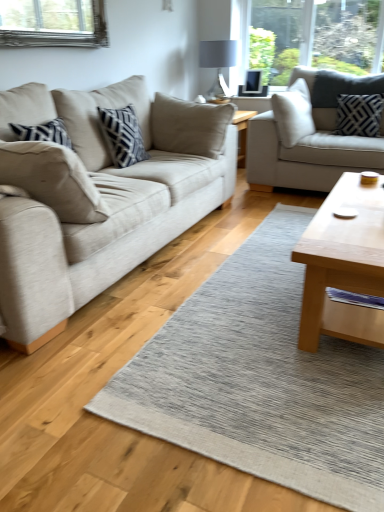
Question: Can you confirm if black textured pillow at upper right, arranged as the first pillow when viewed from the back, is smaller than textured gray rug at center?

Choices:
 (A) no
 (B) yes

Answer: (B)

Question: From the image's perspective, is black textured pillow at upper right, arranged as the second pillow when viewed from the left, located beneath textured gray rug at center?

Choices:
 (A) yes
 (B) no

Answer: (B)

Question: Does black textured pillow at upper right, arranged as the first pillow when viewed from the top, come in front of textured gray rug at center?

Choices:
 (A) no
 (B) yes

Answer: (A)

Question: From the image's perspective, is black textured pillow at upper right, arranged as the first pillow when viewed from the top, over textured gray rug at center?

Choices:
 (A) yes
 (B) no

Answer: (A)

Question: Does black textured pillow at upper right, arranged as the second pillow when viewed from the left, have a greater width compared to textured gray rug at center?

Choices:
 (A) yes
 (B) no

Answer: (B)

Question: Is the surface of black textured pillow at upper right, arranged as the second pillow when viewed from the left, in direct contact with textured gray rug at center?

Choices:
 (A) yes
 (B) no

Answer: (B)

Question: Can you confirm if matte gray glass lampshade at upper center is bigger than light gray fabric couch at upper right, placed as the second studio couch when sorted from left to right?

Choices:
 (A) yes
 (B) no

Answer: (B)

Question: From a real-world perspective, is matte gray glass lampshade at upper center under light gray fabric couch at upper right, marked as the 1th studio couch in a right-to-left arrangement?

Choices:
 (A) no
 (B) yes

Answer: (A)

Question: Is matte gray glass lampshade at upper center oriented away from light gray fabric couch at upper right, marked as the 1th studio couch in a right-to-left arrangement?

Choices:
 (A) no
 (B) yes

Answer: (A)

Question: Is light gray fabric couch at upper right, placed as the second studio couch when sorted from left to right, inside matte gray glass lampshade at upper center?

Choices:
 (A) no
 (B) yes

Answer: (A)

Question: Can we say matte gray glass lampshade at upper center lies outside light gray fabric couch at upper right, placed as the second studio couch when sorted from left to right?

Choices:
 (A) no
 (B) yes

Answer: (B)

Question: Is the position of matte gray glass lampshade at upper center less distant than that of light gray fabric couch at upper right, placed as the second studio couch when sorted from left to right?

Choices:
 (A) yes
 (B) no

Answer: (B)

Question: From a real-world perspective, is light brown wooden coffee table at center right on beige fabric couch at left, the first studio couch positioned from the left?

Choices:
 (A) yes
 (B) no

Answer: (B)